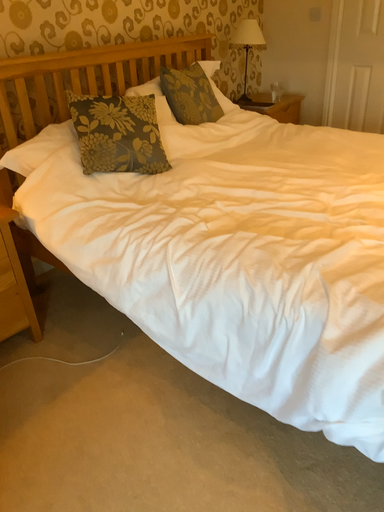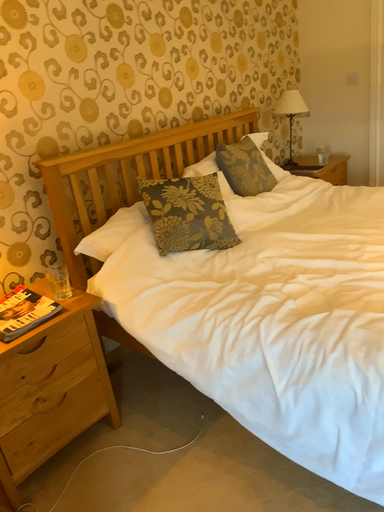
Question: Which way did the camera rotate in the video?

Choices:
 (A) rotated upward
 (B) rotated downward

Answer: (A)